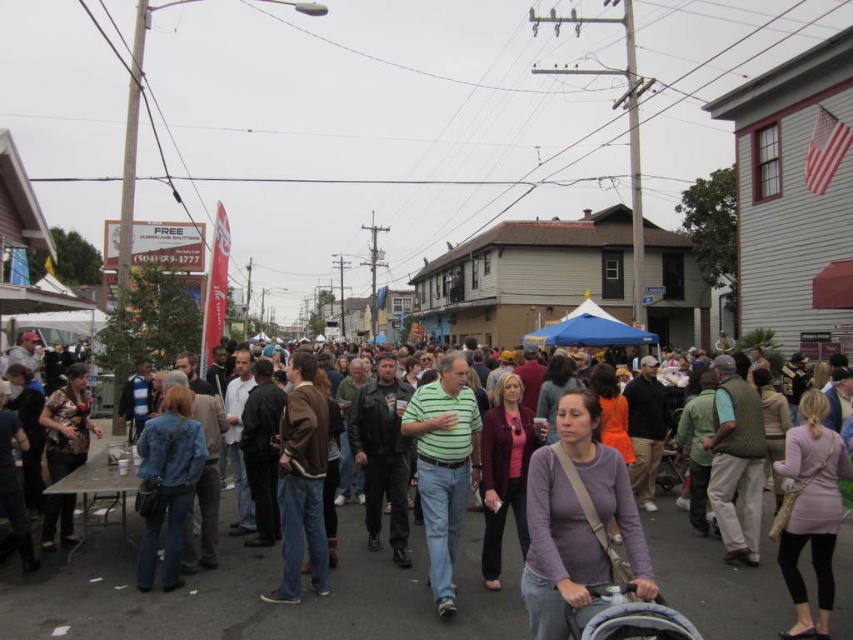
You are a photographer at the event and want to capture both the purple matte sweater at center and the gray fabric baby carriage at lower right in a single frame. Given their sizes, which object should you focus on to ensure both are clearly visible?

The purple matte sweater at center is wider than the gray fabric baby carriage at lower right. To include both in the frame, focus on the purple matte sweater at center since its larger size allows more flexibility in framing while still capturing the smaller gray fabric baby carriage at lower right.

You are standing at the point marked as point [578,522] in the image. What object are you currently standing on?

The point [578,522] corresponds to the purple matte sweater at center, so you are standing on the purple matte sweater at center.

You are a photographer at the event and want to capture both the purple matte sweater at center and the gray fabric baby carriage at lower right in a single shot. Given their sizes, which object would you need to frame more prominently in your composition?

The purple matte sweater at center has a larger size compared to the gray fabric baby carriage at lower right, so you should frame the purple matte sweater at center more prominently in your composition to reflect their relative sizes accurately.